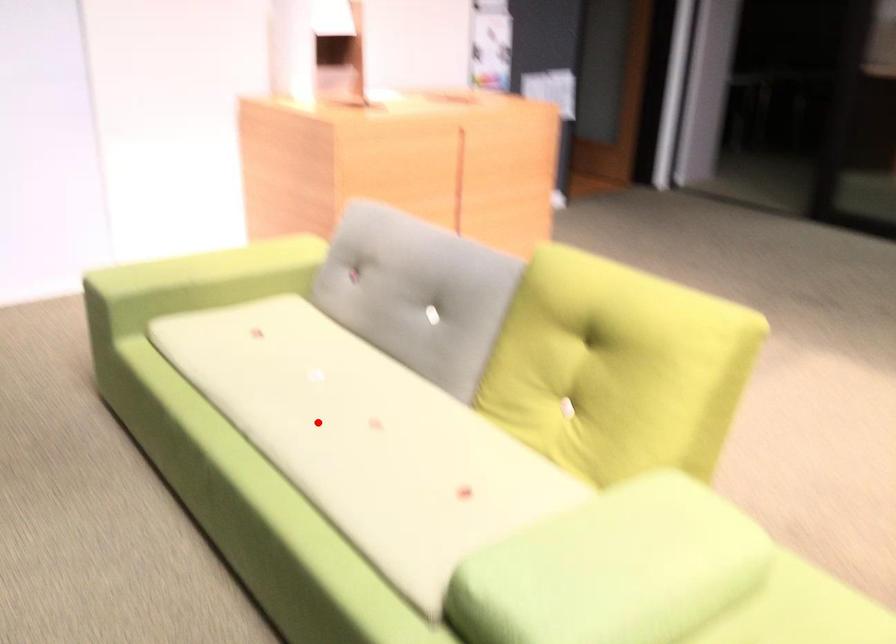
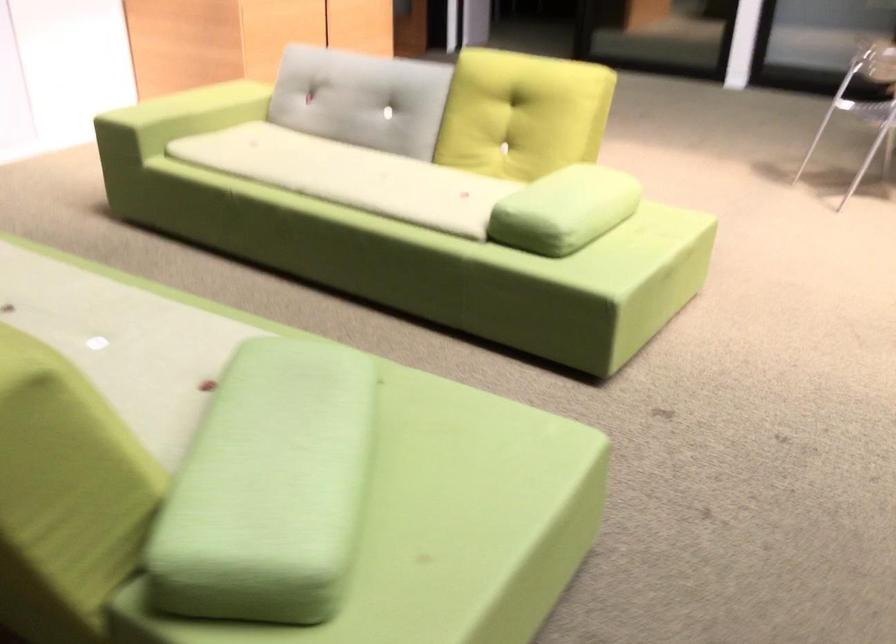
Question: I am providing you with two images of the same scene from different viewpoints. Image1 has a red point marked. In image2, the corresponding 3D location appears at what relative position? Reply with the corresponding letter.

Choices:
 (A) Closer
 (B) Farther

Answer: (B)